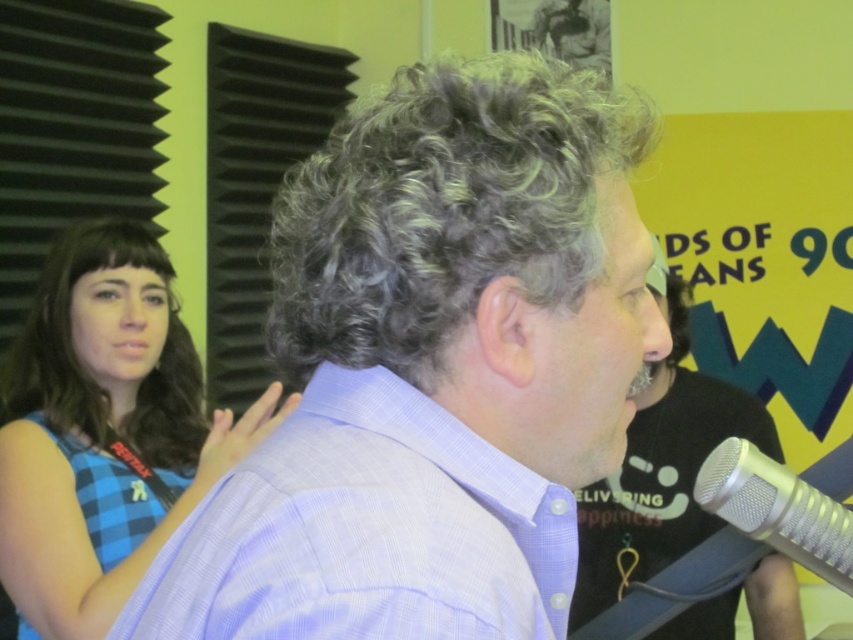
Between silver metallic microphone at lower right and blue checkered shirt at left, which one has less height?

Standing shorter between the two is silver metallic microphone at lower right.

Is silver metallic microphone at lower right further to camera compared to blue checkered shirt at left?

That is False.

Measure the distance between silver metallic microphone at lower right and camera.

33.93 inches

Locate an element on the screen. This screenshot has height=640, width=853. silver metallic microphone at lower right is located at coordinates (782, 504).

Who is positioned more to the left, gray curly hair at center or blue shiny hair at left?

From the viewer's perspective, blue shiny hair at left appears more on the left side.

Can you confirm if gray curly hair at center is positioned below blue shiny hair at left?

No.

Describe the element at coordinates (442, 209) in the screenshot. I see `gray curly hair at center` at that location.

Identify the location of gray curly hair at center. (442, 209).

Can you confirm if gray curly hair at center is positioned above silver metallic microphone at lower right?

Indeed, gray curly hair at center is positioned over silver metallic microphone at lower right.

Is gray curly hair at center smaller than silver metallic microphone at lower right?

No.

Who is more distant from viewer, (427,72) or (804,557)?

The point (804,557) is more distant.

The image size is (853, 640). In order to click on gray curly hair at center in this screenshot , I will do coord(442,209).